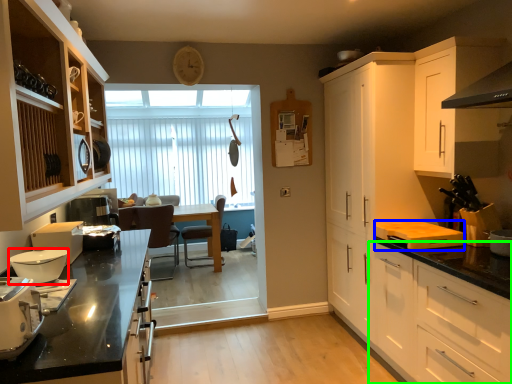
Question: Which is nearer to the kitchen appliance (highlighted by a red box)? appliance (highlighted by a blue box) or cabinetry (highlighted by a green box).

Choices:
 (A) appliance
 (B) cabinetry

Answer: (B)